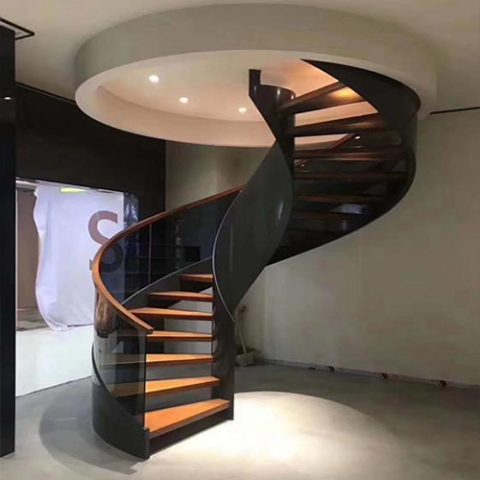
Image resolution: width=480 pixels, height=480 pixels. I want to click on hallway floor, so click(41, 335).